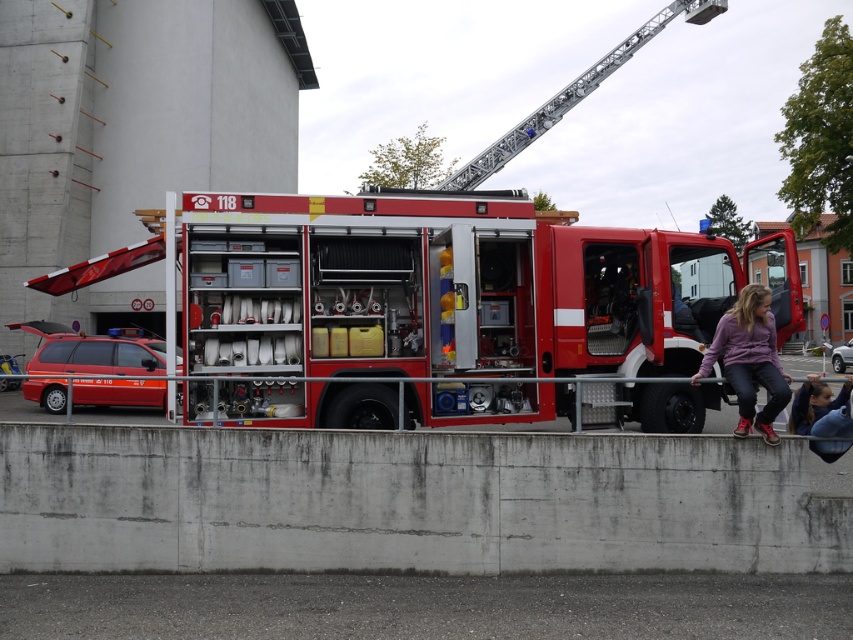
Question: Which of the following is the farthest from the observer?

Choices:
 (A) (788, 413)
 (B) (846, 364)

Answer: (B)

Question: Does concrete at lower center appear over metallic red car at left?

Choices:
 (A) no
 (B) yes

Answer: (A)

Question: Does dark blue fabric jacket at lower right lie in front of metallic silver car at center?

Choices:
 (A) no
 (B) yes

Answer: (B)

Question: Among these objects, which one is farthest from the camera?

Choices:
 (A) metallic red car at left
 (B) concrete at lower center

Answer: (A)

Question: Estimate the real-world distances between objects in this image. Which object is farther from the purple fleece jacket at lower right?

Choices:
 (A) metallic red fire truck at center
 (B) dark blue fabric jacket at lower right
 (C) metallic silver car at center

Answer: (C)

Question: Can you confirm if metallic red fire truck at center is positioned above dark blue fabric jacket at lower right?

Choices:
 (A) no
 (B) yes

Answer: (A)